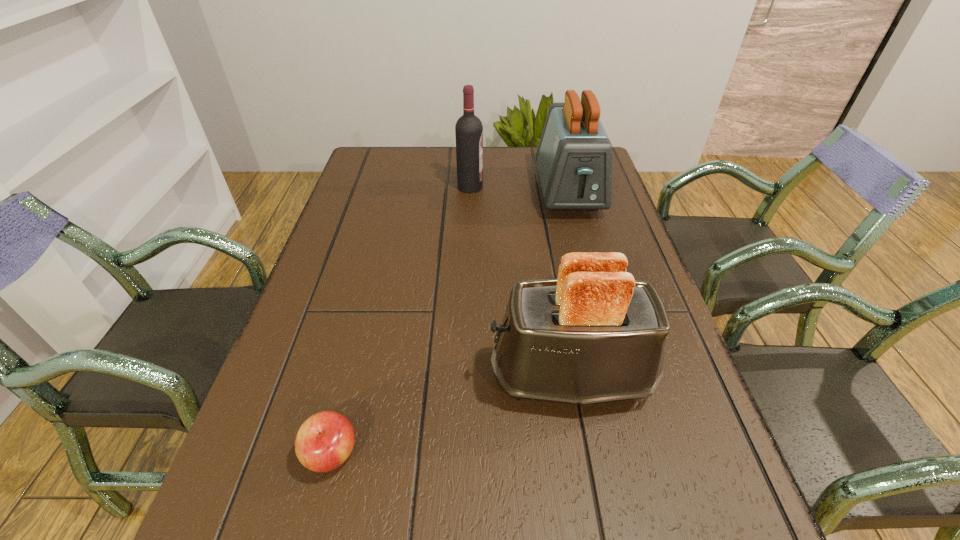
Locate an element on the screen. the third object from right to left is located at coordinates pyautogui.click(x=468, y=130).

The height and width of the screenshot is (540, 960). I want to click on the farther toaster, so click(x=574, y=157).

The image size is (960, 540). I want to click on the nearer toaster, so click(x=593, y=335).

Find the location of a particular element. Image resolution: width=960 pixels, height=540 pixels. apple is located at coordinates (325, 440).

This screenshot has height=540, width=960. I want to click on the shortest object, so click(x=325, y=440).

The width and height of the screenshot is (960, 540). What are the coordinates of `free space located 0.270m on the label of the wine bottle` in the screenshot? It's located at (569, 187).

Locate an element on the screen. free location located on the front-facing side of the farther toaster is located at coordinates (597, 300).

Identify the location of free spot located on the side of the second nearest object with the control lever. point(336,376).

You are a GUI agent. You are given a task and a screenshot of the screen. Output one action in this format:
    pyautogui.click(x=<x>, y=<y>)
    Task: Click on the free space located on the side of the second nearest object with the control lever
    
    Given the screenshot: What is the action you would take?
    pyautogui.click(x=305, y=376)

The image size is (960, 540). In order to click on vacant space located on the side of the second nearest object with the control lever in this screenshot , I will do `click(459, 376)`.